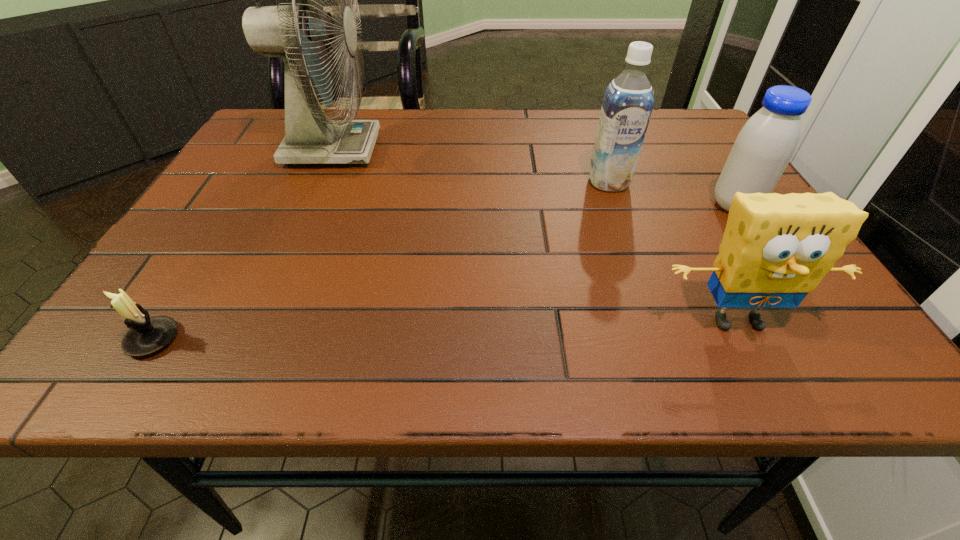
The image size is (960, 540). What are the coordinates of `free space between the taller soya milk and the shortest object` in the screenshot? It's located at (381, 261).

Where is `vacant area between the sponge and the tallest object`? vacant area between the sponge and the tallest object is located at coordinates (535, 235).

Where is `unoccupied position between the left soya milk and the right soya milk`? The width and height of the screenshot is (960, 540). unoccupied position between the left soya milk and the right soya milk is located at coordinates (672, 194).

Locate an element on the screen. The width and height of the screenshot is (960, 540). free space between the fan and the right soya milk is located at coordinates (534, 178).

Image resolution: width=960 pixels, height=540 pixels. What are the coordinates of `free space between the left soya milk and the tallest object` in the screenshot? It's located at (470, 166).

I want to click on unoccupied area between the leftmost object and the sponge, so click(445, 330).

The image size is (960, 540). Identify the location of free space that is in between the second object from left to right and the candle holder. (243, 245).

Where is `object that is the fourth closest to the leftmost object`? object that is the fourth closest to the leftmost object is located at coordinates (763, 148).

Image resolution: width=960 pixels, height=540 pixels. I want to click on object that ranks as the third closest to the second object from left to right, so click(x=776, y=249).